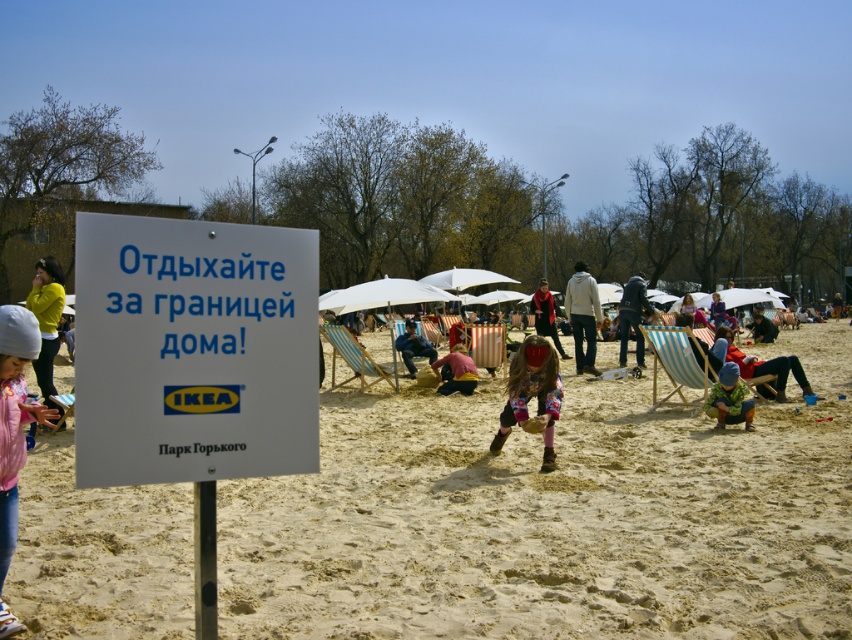
Question: Which object is positioned farthest from the blue knitted hat at lower right?

Choices:
 (A) white striped umbrella at center
 (B) pink fleece jacket at lower left

Answer: (B)

Question: Is yellow matte jacket at upper left below striped fabric beach chair at center?

Choices:
 (A) yes
 (B) no

Answer: (B)

Question: Is white striped umbrella at center below blue knitted hat at lower right?

Choices:
 (A) no
 (B) yes

Answer: (A)

Question: Which of these objects is positioned farthest from the red knitwear at center?

Choices:
 (A) white paper sign at center
 (B) blue striped chair at center
 (C) striped fabric beach chair at center
 (D) wooden striped beach chair at center

Answer: (A)

Question: Which point is closer to the camera?

Choices:
 (A) (751, 422)
 (B) (639, 280)
 (C) (50, 378)

Answer: (A)

Question: Is light brown sand at center thinner than blue striped chair at center?

Choices:
 (A) no
 (B) yes

Answer: (A)